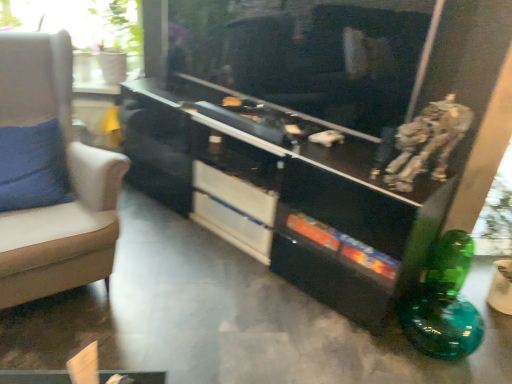
Question: Is the depth of transparent glass window at upper left less than that of metallic silver robot at upper right?

Choices:
 (A) no
 (B) yes

Answer: (A)

Question: Does transparent glass window at upper left have a lesser height compared to metallic silver robot at upper right?

Choices:
 (A) yes
 (B) no

Answer: (B)

Question: Considering the relative sizes of transparent glass window at upper left and metallic silver robot at upper right in the image provided, is transparent glass window at upper left smaller than metallic silver robot at upper right?

Choices:
 (A) yes
 (B) no

Answer: (B)

Question: From a real-world perspective, does transparent glass window at upper left stand above metallic silver robot at upper right?

Choices:
 (A) no
 (B) yes

Answer: (B)

Question: Does transparent glass window at upper left have a greater width compared to metallic silver robot at upper right?

Choices:
 (A) yes
 (B) no

Answer: (A)

Question: From a real-world perspective, is metallic silver robot at upper right positioned above or below beige fabric chair at left?

Choices:
 (A) above
 (B) below

Answer: (A)

Question: Is metallic silver robot at upper right in front of or behind beige fabric chair at left in the image?

Choices:
 (A) front
 (B) behind

Answer: (B)

Question: Which is correct: metallic silver robot at upper right is inside beige fabric chair at left, or outside of it?

Choices:
 (A) inside
 (B) outside

Answer: (B)

Question: Considering the relative positions of metallic silver robot at upper right and beige fabric chair at left in the image provided, is metallic silver robot at upper right to the left or to the right of beige fabric chair at left?

Choices:
 (A) right
 (B) left

Answer: (A)

Question: Looking at the image, does white glossy drawer at center, which is the first drawer from top to bottom, seem bigger or smaller compared to metallic silver robot at upper right?

Choices:
 (A) small
 (B) big

Answer: (B)

Question: From a real-world perspective, is white glossy drawer at center, which is the first drawer from top to bottom, positioned above or below metallic silver robot at upper right?

Choices:
 (A) above
 (B) below

Answer: (B)

Question: In the image, is white glossy drawer at center, arranged as the 2th drawer when ordered from the bottom, positioned in front of or behind metallic silver robot at upper right?

Choices:
 (A) front
 (B) behind

Answer: (B)

Question: Based on their positions, is white glossy drawer at center, which is the first drawer from top to bottom, located to the left or right of metallic silver robot at upper right?

Choices:
 (A) left
 (B) right

Answer: (A)

Question: Is white glossy drawer at center, arranged as the 2th drawer when ordered from the bottom, bigger or smaller than white glossy drawer at center, the second drawer viewed from the top?

Choices:
 (A) big
 (B) small

Answer: (A)

Question: In terms of width, does white glossy drawer at center, which is the first drawer from top to bottom, look wider or thinner when compared to white glossy drawer at center, arranged as the first drawer when ordered from the bottom?

Choices:
 (A) wide
 (B) thin

Answer: (A)